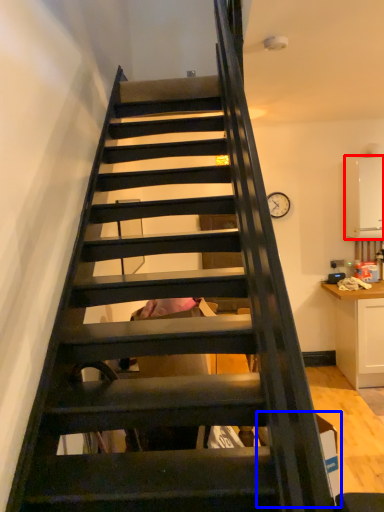
Question: Which point is further to the camera, appliance (highlighted by a red box) or cardboard box (highlighted by a blue box)?

Choices:
 (A) appliance
 (B) cardboard box

Answer: (A)